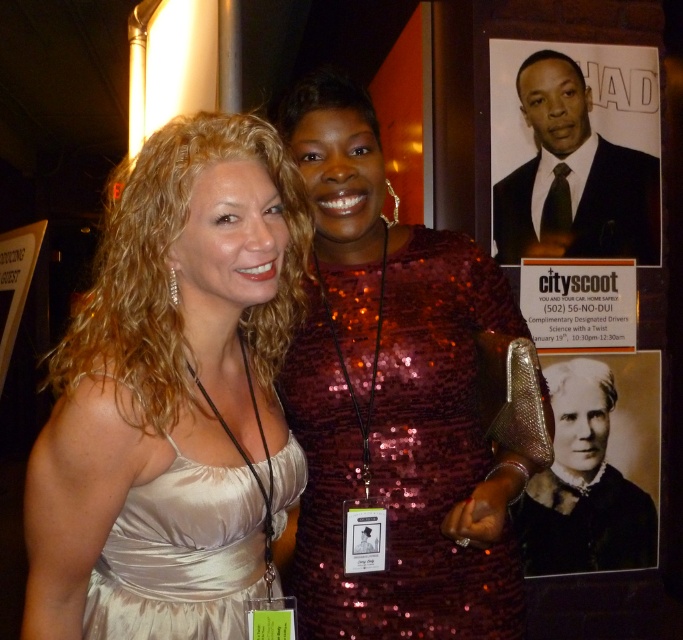
Question: Is satin dress at left further to camera compared to matte black suit at upper right?

Choices:
 (A) yes
 (B) no

Answer: (B)

Question: Which of the following is the farthest from the observer?

Choices:
 (A) (591, 252)
 (B) (630, 324)
 (C) (581, 364)

Answer: (B)

Question: Which point is farther from the camera taking this photo?

Choices:
 (A) (538, 232)
 (B) (139, 637)
 (C) (525, 458)
 (D) (143, 180)

Answer: (A)

Question: Which point appears closest to the camera in this image?

Choices:
 (A) (167, 525)
 (B) (619, 292)

Answer: (A)

Question: Is sequined dress at center positioned behind matte black suit at upper right?

Choices:
 (A) yes
 (B) no

Answer: (B)

Question: Observing the image, what is the correct spatial positioning of satin dress at center in reference to black matte portrait at upper right?

Choices:
 (A) left
 (B) right

Answer: (A)